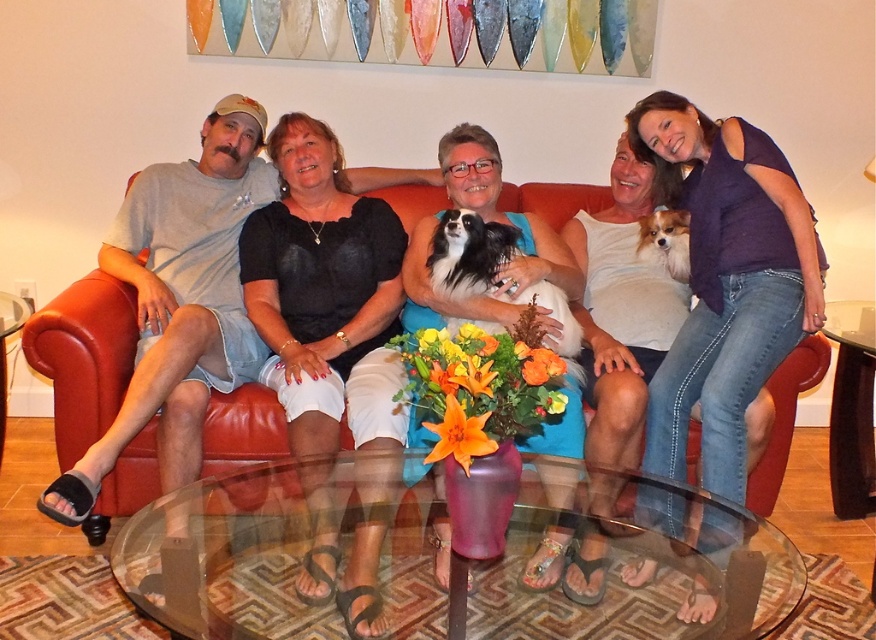
Looking at this image, you are standing in the living room and want to take a photo of the two points mentioned. Which point, point [325,179] or point [661,250], will appear larger in your camera view?

Point [325,179] is closer to the camera than point [661,250], so it will appear larger in the camera view.

You are a photographer trying to capture a closeup of the black velvet blouse at center and the fluffy white dog at upper right. Since you can only focus on one subject at a time, which one should you choose to ensure it fills more of the frame without cropping?

The black velvet blouse at center should be chosen because its width is greater than the fluffy white dog at upper right, making it the larger subject and thus better suited to fill the frame without cropping.

You are standing at the point marked as point (323, 381). You need to hand a gift to someone who is 7.16 feet away from you. Which of the following people can you give the gift to? Please choose from the group of five people sitting on the red leather couch.

Since the people are 7.16 feet apart from the point (323, 381), you can give the gift to any of the five people sitting on the red leather couch as they are all within that distance range.